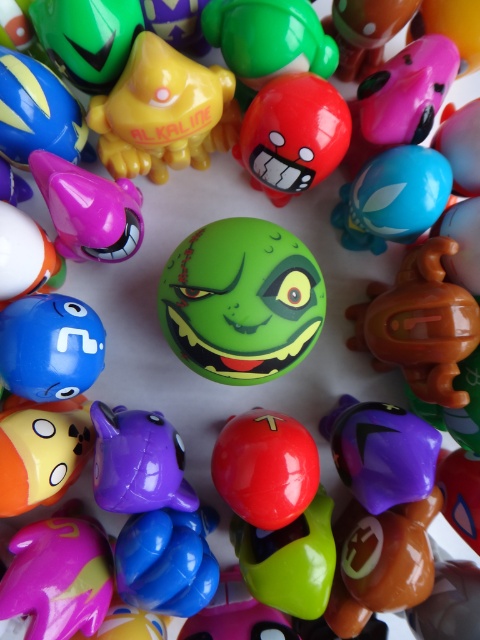
Question: Where is brown matte toy at lower right located in relation to blue matte ball at center in the image?

Choices:
 (A) right
 (B) left

Answer: (A)

Question: Can you confirm if yellow matte cat at upper left is positioned below brown matte toy at lower right?

Choices:
 (A) yes
 (B) no

Answer: (B)

Question: Which point appears closest to the camera in this image?

Choices:
 (A) (160, 76)
 (B) (320, 304)
 (C) (312, 131)
 (D) (439, 332)

Answer: (A)

Question: Which is nearer to the matte plastic toy at center?

Choices:
 (A) green matte toy at upper center
 (B) yellow matte cat at upper left
 (C) matte green plastic toy at upper left

Answer: (A)

Question: Which object is the farthest from the matte purple toy at upper left?

Choices:
 (A) brown matte toy at lower right
 (B) green matte toy at upper center
 (C) yellow matte cat at upper left

Answer: (A)

Question: Does yellow matte cat at upper left have a larger size compared to matte green plastic toy at upper left?

Choices:
 (A) no
 (B) yes

Answer: (B)